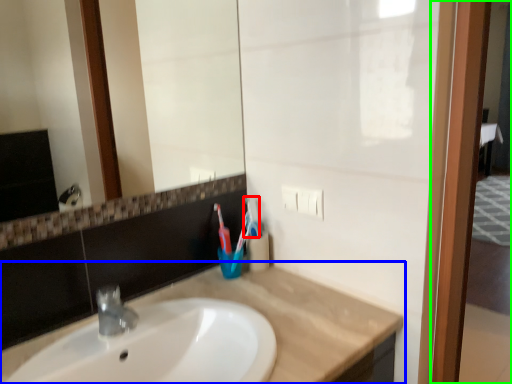
Question: Estimate the real-world distances between objects in this image. Which object is farther from toothbrush (highlighted by a red box), countertop (highlighted by a blue box) or screen door (highlighted by a green box)?

Choices:
 (A) countertop
 (B) screen door

Answer: (B)